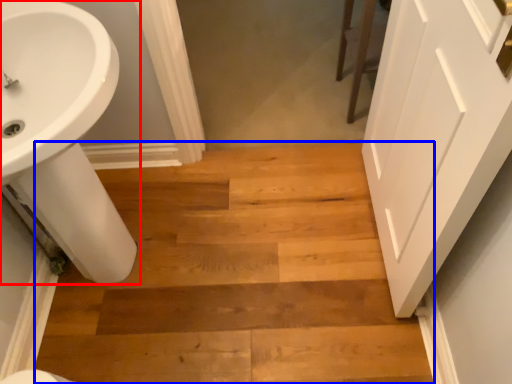
Question: Which point is closer to the camera, sink (highlighted by a red box) or stairwell (highlighted by a blue box)?

Choices:
 (A) sink
 (B) stairwell

Answer: (A)